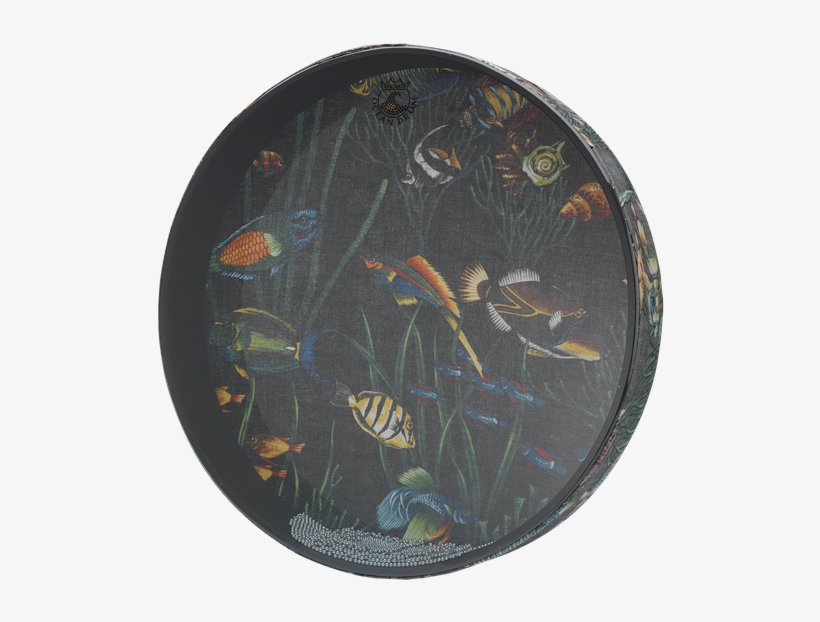
Where is `decorative service tray`? The image size is (820, 622). decorative service tray is located at coordinates (577, 132).